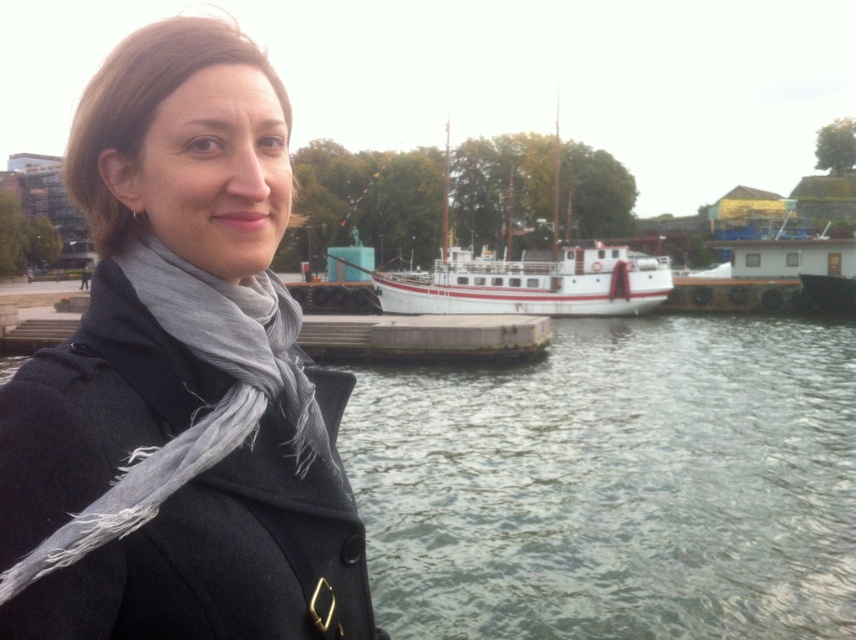
Question: Which point appears farthest from the camera in this image?

Choices:
 (A) (609, 488)
 (B) (605, 291)

Answer: (B)

Question: Estimate the real-world distances between objects in this image. Which object is farther from the white matte boat at center?

Choices:
 (A) gray fringed scarf at left
 (B) greenish water at lower center

Answer: (A)

Question: Is greenish water at lower center positioned behind gray fringed scarf at left?

Choices:
 (A) no
 (B) yes

Answer: (B)

Question: Does greenish water at lower center have a larger size compared to white matte boat at center?

Choices:
 (A) no
 (B) yes

Answer: (A)

Question: Is gray fringed scarf at left thinner than white matte boat at center?

Choices:
 (A) yes
 (B) no

Answer: (A)

Question: Which object is positioned closest to the white matte boat at center?

Choices:
 (A) gray fringed scarf at left
 (B) greenish water at lower center

Answer: (B)